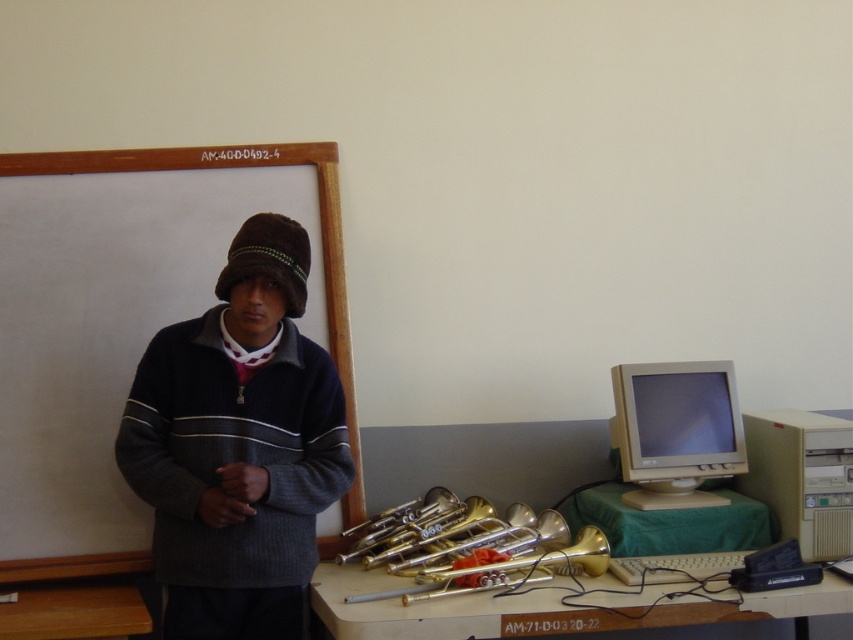
Is metallic brass instruments at lower center above brown wooden table at lower left?

Yes.

Does metallic brass instruments at lower center have a smaller size compared to brown wooden table at lower left?

Incorrect, metallic brass instruments at lower center is not smaller in size than brown wooden table at lower left.

Is point (718, 604) closer to viewer compared to point (80, 618)?

Yes, it is.

Image resolution: width=853 pixels, height=640 pixels. What are the coordinates of `metallic brass instruments at lower center` in the screenshot? It's located at (550, 605).

Is gold brass trumpet at center positioned behind beige plastic computer at right?

No, it is not.

Find the location of `gold brass trumpet at center`. gold brass trumpet at center is located at coordinates (474, 545).

At what (x,y) coordinates should I click in order to perform the action: click on gold brass trumpet at center. Please return your answer as a coordinate pair (x, y). The width and height of the screenshot is (853, 640). Looking at the image, I should click on (474, 545).

Looking at this image, does dark blue knitted sweater at center have a lesser width compared to beige plastic monitor at right?

No, dark blue knitted sweater at center is not thinner than beige plastic monitor at right.

Which is behind, point (351, 474) or point (700, 419)?

Point (700, 419)

Find the location of a particular element. The image size is (853, 640). dark blue knitted sweater at center is located at coordinates (233, 452).